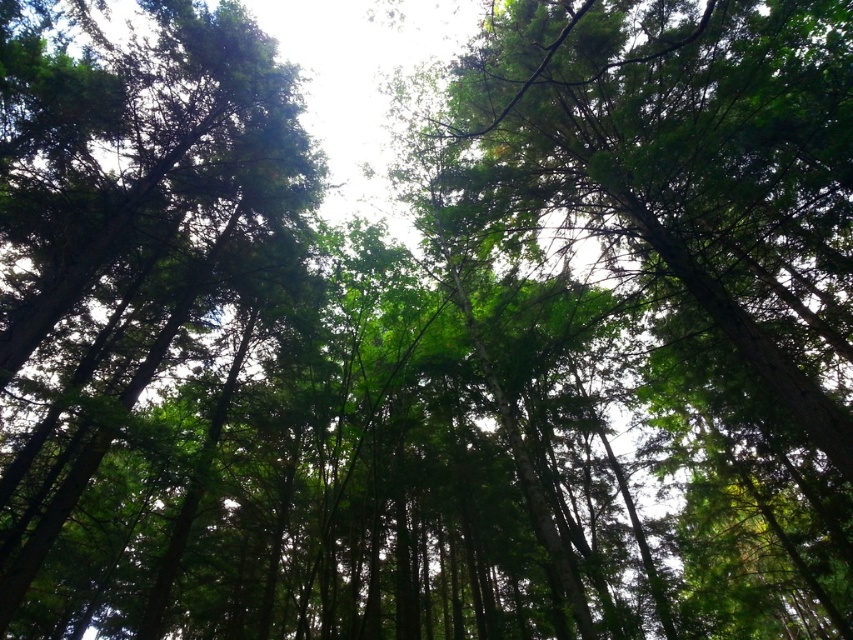
Find the location of `green leafy tree at center`. green leafy tree at center is located at coordinates (692, 248).

Who is taller, green leafy tree at center or green matte tree at upper left?

Standing taller between the two is green leafy tree at center.

At what (x,y) coordinates should I click in order to perform the action: click on green leafy tree at center. Please return your answer as a coordinate pair (x, y). This screenshot has height=640, width=853. Looking at the image, I should click on (692, 248).

Identify the location of green leafy tree at center. (692, 248).